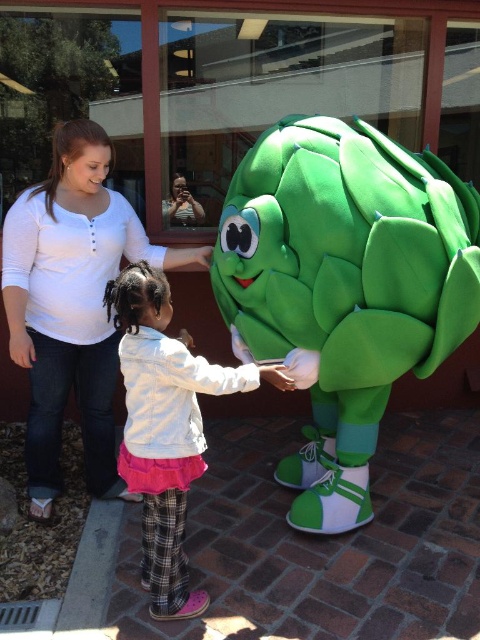
Can you confirm if green plush artichoke at center is thinner than white matte shirt at upper left?

No.

Which is below, green plush artichoke at center or white matte shirt at upper left?

Positioned lower is green plush artichoke at center.

Which is in front, point (307, 208) or point (99, 131)?

Point (307, 208) is in front.

The width and height of the screenshot is (480, 640). Identify the location of green plush artichoke at center. (345, 288).

Is white matte shirt at upper left shorter than white fleece jacket at center?

No.

Is point (108, 248) more distant than point (179, 490)?

Yes, point (108, 248) is behind point (179, 490).

Which is in front, point (88, 145) or point (179, 444)?

Point (179, 444) is more forward.

Locate an element on the screen. The height and width of the screenshot is (640, 480). white matte shirt at upper left is located at coordinates (72, 305).

Does green plush artichoke at center appear over white fleece jacket at center?

Yes.

Measure the distance from green plush artichoke at center to white fleece jacket at center.

The distance of green plush artichoke at center from white fleece jacket at center is 22.28 inches.

Is point (408, 259) farther from viewer compared to point (180, 419)?

Yes.

Where is `green plush artichoke at center`? The height and width of the screenshot is (640, 480). green plush artichoke at center is located at coordinates (345, 288).